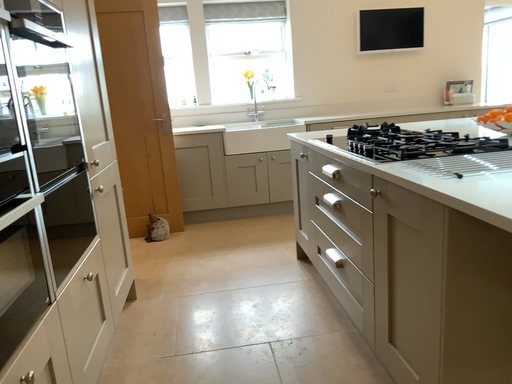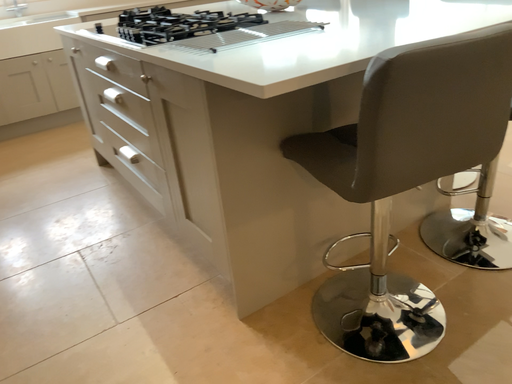
Question: Which way did the camera rotate in the video?

Choices:
 (A) rotated upward
 (B) rotated downward

Answer: (B)